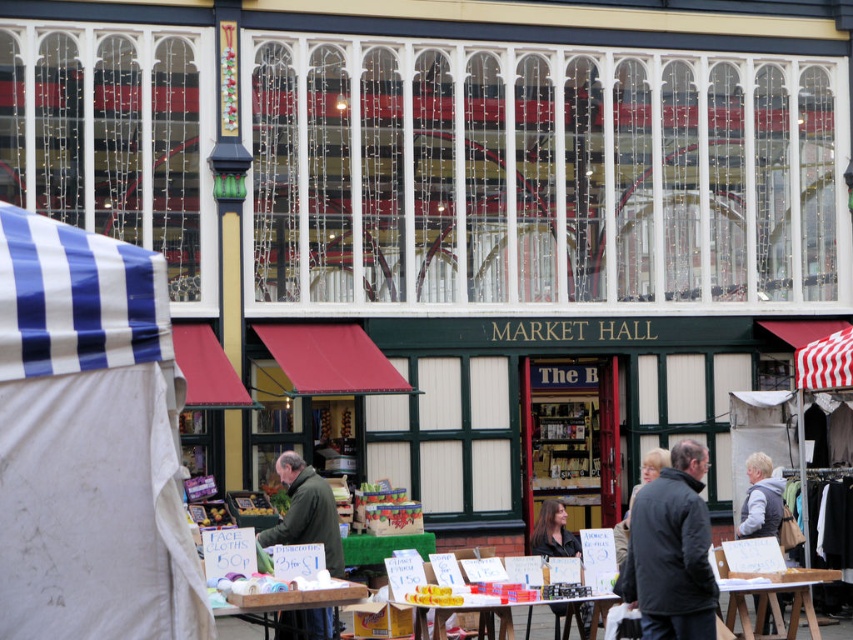
You are a customer at the Market Hall. You see a green matte jacket at center and a translucent plastic table at center. Which object is positioned higher in the scene?

A: The green matte jacket at center is above the translucent plastic table at center, so it is positioned higher in the scene.

You are a customer at the market and see both the dark brown hair at center and the translucent plastic table at center. Which object is positioned to the right side from your perspective?

The dark brown hair at center is to the right of the translucent plastic table at center, so the dark brown hair at center is positioned to the right side.